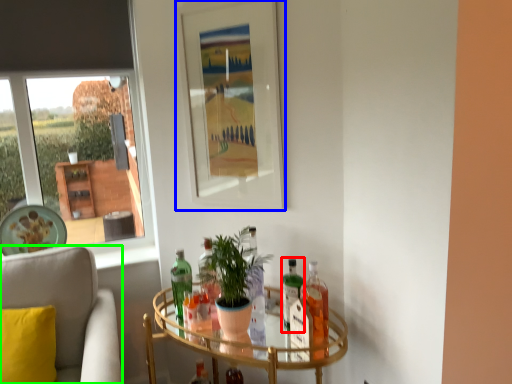
Question: Based on their relative distances, which object is nearer to bottle (highlighted by a red box)? Choose from picture frame (highlighted by a blue box) and chair (highlighted by a green box).

Choices:
 (A) picture frame
 (B) chair

Answer: (A)